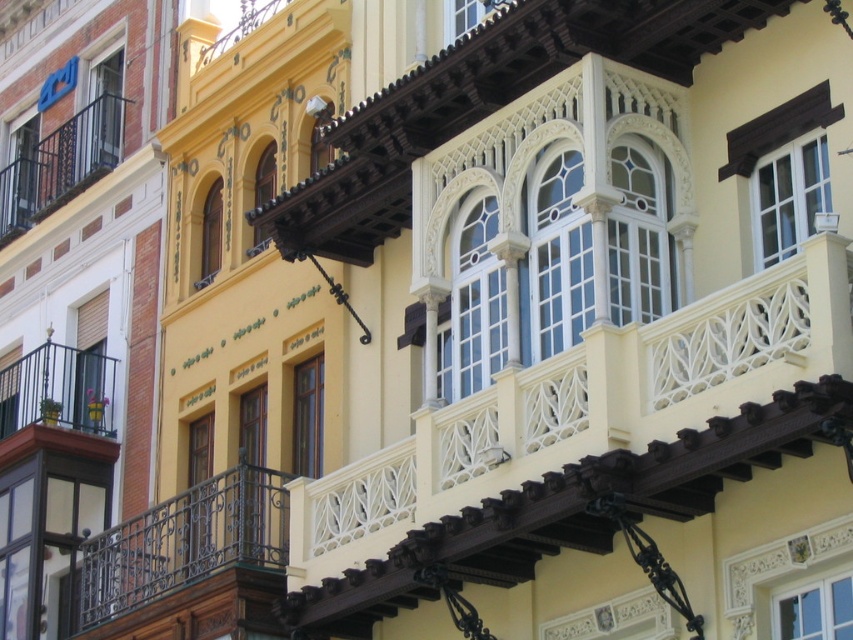
You are standing in front of the building with the light yellow facade. You notice the rustic wrought iron balcony at left. Can you estimate its location relative to the bottom left corner of the building?

The rustic wrought iron balcony at left is located at point 0.631 along the horizontal axis and 0.068 along the vertical axis relative to the bottom left corner of the building.

What is located at the coordinate point (57, 403) in the image?

At point (57, 403) lies a rustic wrought iron balcony at left.